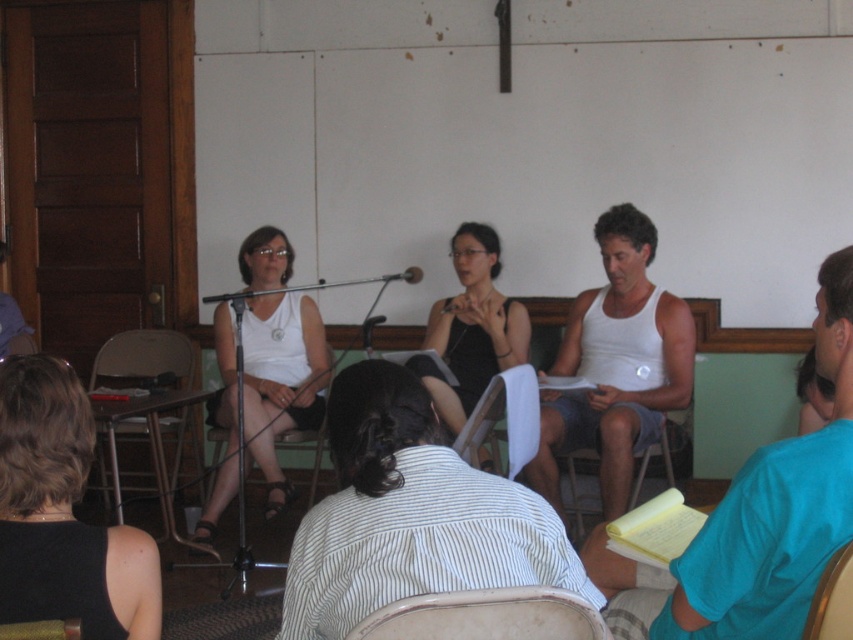
In the scene described, there is a person wearing a striped shirt facing away and another individual in a teal shirt holding notebooks. Where is the white matte tank top located in relation to the point marked at coordinates (281, 380)?

The point at (281, 380) corresponds to the white matte tank top at center, so it is located exactly at that coordinate.

You are standing at the entrance of the room and want to greet the person in the white matte tank top at center. Which direction should you move to approach them while avoiding the wooden chair at center?

The wooden chair at center is behind the white matte tank top at center, so you should move forward towards the white matte tank top at center to approach them without encountering the wooden chair at center.

You are standing in the room and want to hand a document to the person wearing the white matte tank top at center. There is a metallic gold chair at lower right in your way. Can you reach the person without moving the chair?

The white matte tank top at center is further to the viewer than the metallic gold chair at lower right, so the chair is between you and the person. You will need to move the metallic gold chair at lower right out of the way to reach the person wearing the white matte tank top at center.